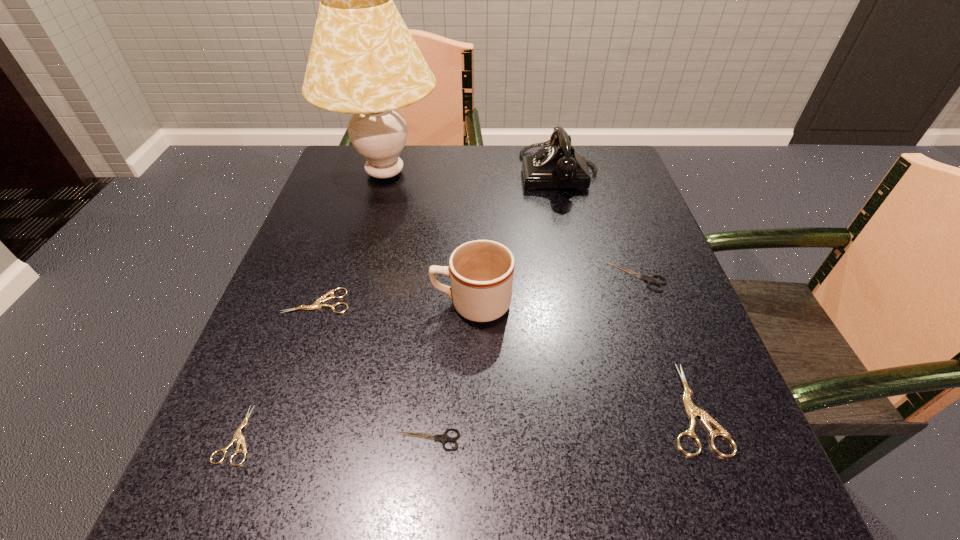
Where is `object situated at the far right corner`? The image size is (960, 540). object situated at the far right corner is located at coordinates (558, 165).

The image size is (960, 540). In the image, there is a desktop. In order to click on vacant space at the far edge in this screenshot , I will do click(x=516, y=196).

At what (x,y) coordinates should I click in order to perform the action: click on vacant space at the near edge of the desktop. Please return your answer as a coordinate pair (x, y). This screenshot has width=960, height=540. Looking at the image, I should click on (316, 508).

Locate an element on the screen. The image size is (960, 540). vacant space at the left edge is located at coordinates (319, 428).

Identify the location of free space at the right edge of the desktop. (700, 393).

Identify the location of blank space at the far left corner of the desktop. This screenshot has width=960, height=540. [x=339, y=176].

This screenshot has width=960, height=540. I want to click on vacant space at the near right corner, so click(x=744, y=514).

You are a GUI agent. You are given a task and a screenshot of the screen. Output one action in this format:
    pyautogui.click(x=<x>, y=<y>)
    Task: Click on the vacant area between the black telephone and the farthest beige shears
    The height and width of the screenshot is (540, 960).
    Given the screenshot: What is the action you would take?
    pyautogui.click(x=439, y=237)

Locate an element on the screen. The width and height of the screenshot is (960, 540). free space between the yellow lampshade and the right black shears is located at coordinates (511, 225).

Identify the location of free point between the farthest beige shears and the lampshade. The width and height of the screenshot is (960, 540). (351, 237).